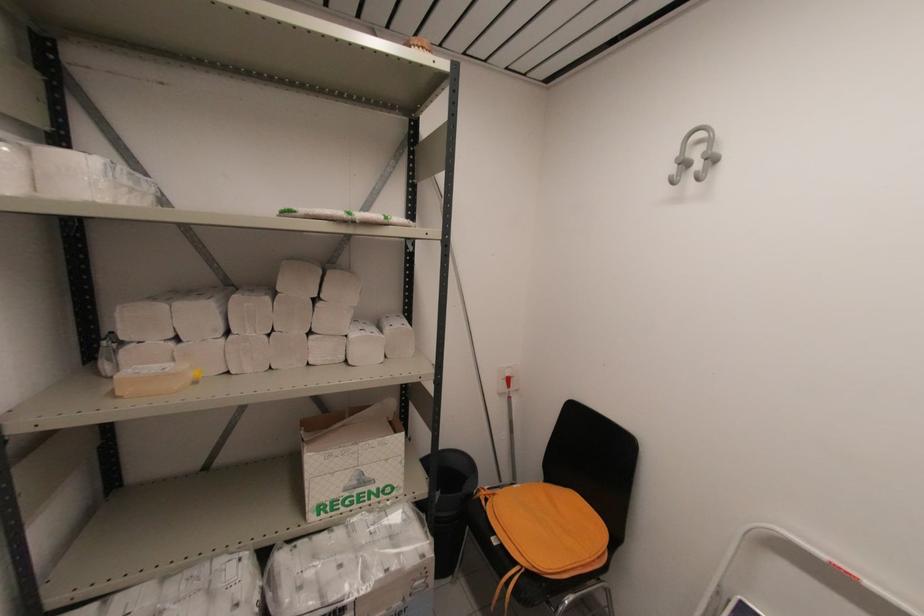
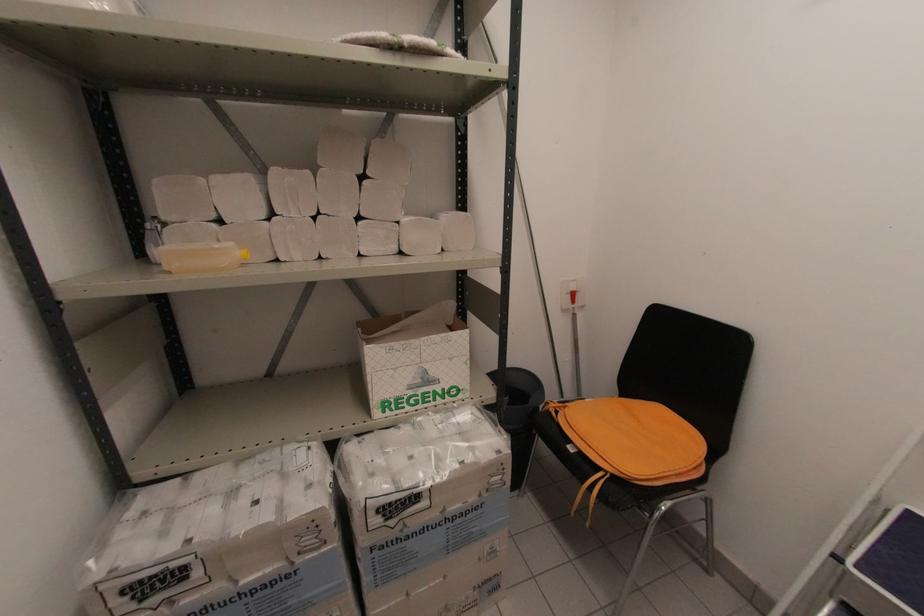
Question: Based on the continuous images, in which direction is the camera rotating? Reply with the corresponding letter.

Choices:
 (A) Left
 (B) Right
 (C) Up
 (D) Down

Answer: (A)